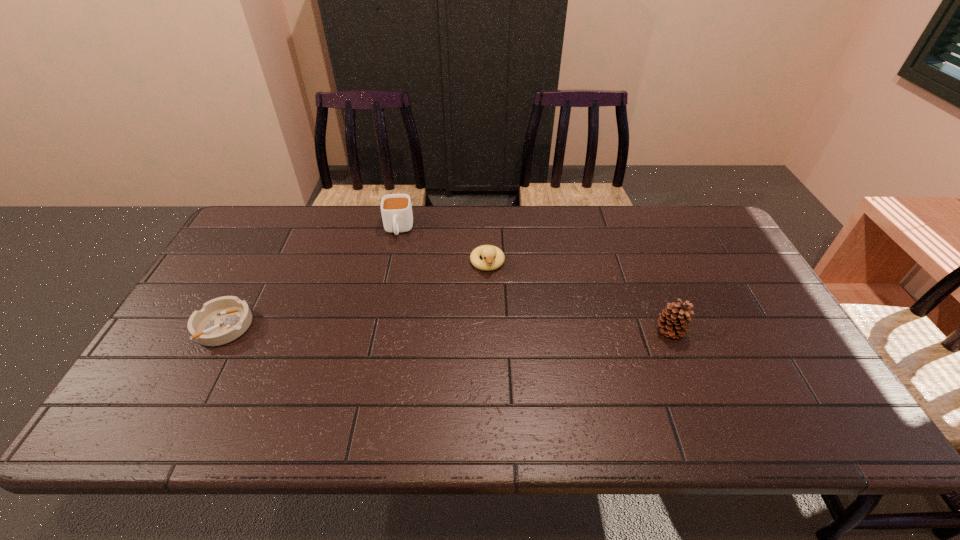
What are the coordinates of `free space on the desktop that is between the ashtray and the rightmost object and is positioned on the side with the handle of the farthest object` in the screenshot? It's located at click(x=389, y=328).

Where is `vacant space on the desktop that is between the ashtray and the tallest object and is positioned at the beak of the third tallest object`? The width and height of the screenshot is (960, 540). vacant space on the desktop that is between the ashtray and the tallest object and is positioned at the beak of the third tallest object is located at coordinates (499, 329).